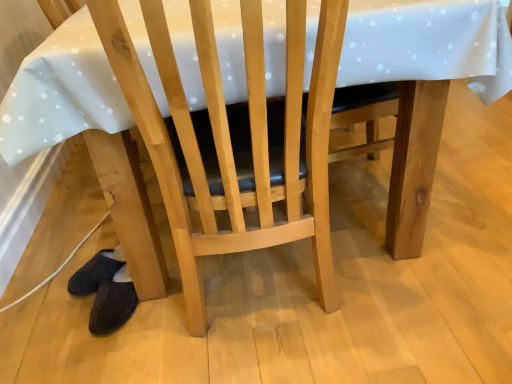
Find the location of a particular element. The width and height of the screenshot is (512, 384). vacant space to the right of wooden chair at center is located at coordinates (408, 276).